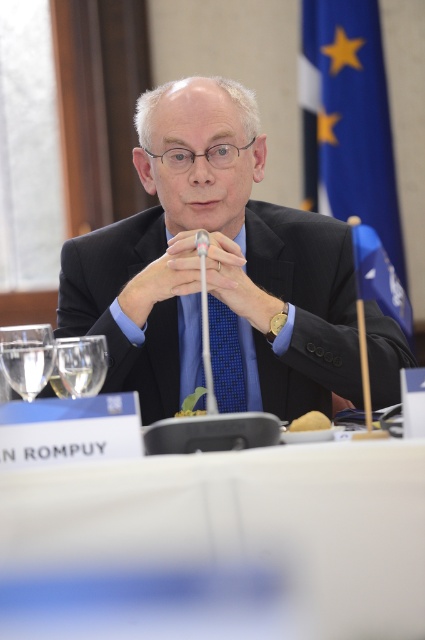
You are a photographer standing at the back of the room. You want to take a photo of the man and the blue fabric flag at upper right in the same frame. The camera you are using has a maximum focus range of 10 feet. Can you capture both subjects clearly in one shot?

The man and the blue fabric flag at upper right are 9.59 feet apart, so yes, the camera can capture both clearly in one shot since the distance between them is within the 10 feet focus range.